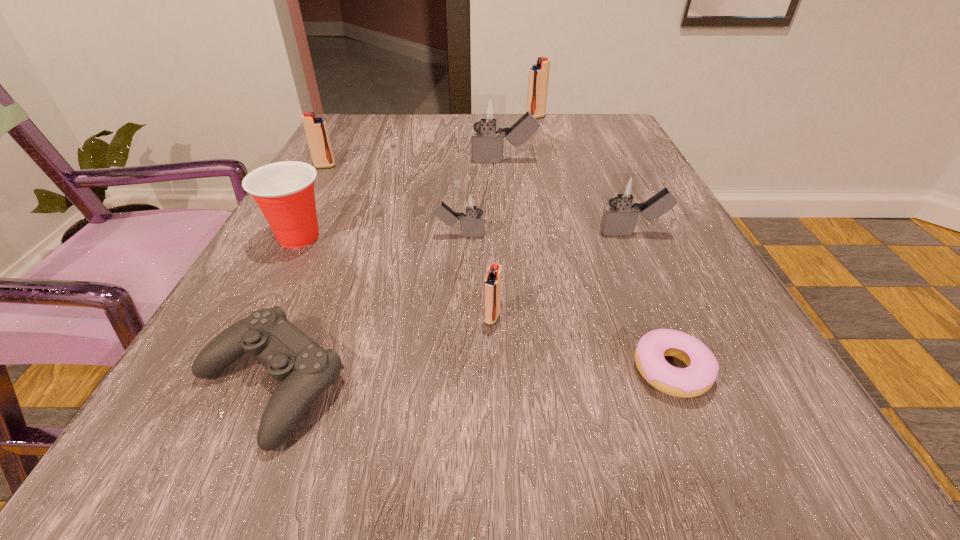
Where is `the farthest igniter`? This screenshot has width=960, height=540. the farthest igniter is located at coordinates (538, 79).

This screenshot has height=540, width=960. Find the location of `the biggest red igniter`. the biggest red igniter is located at coordinates pos(538,79).

The height and width of the screenshot is (540, 960). Find the location of `the farthest gray igniter`. the farthest gray igniter is located at coordinates (488, 112).

The image size is (960, 540). What are the coordinates of `the rightmost igniter` in the screenshot? It's located at (619, 218).

The height and width of the screenshot is (540, 960). Identify the location of the rightmost gray igniter. pos(619,218).

The height and width of the screenshot is (540, 960). Find the location of `the leftmost red igniter`. the leftmost red igniter is located at coordinates (316, 131).

Image resolution: width=960 pixels, height=540 pixels. In order to click on the leftmost igniter in this screenshot , I will do `click(316, 131)`.

Image resolution: width=960 pixels, height=540 pixels. Find the location of `red cup`. red cup is located at coordinates (284, 191).

Identify the location of the smallest red igniter. The width and height of the screenshot is (960, 540). (492, 284).

Locate an element on the screen. This screenshot has width=960, height=540. the nearest red igniter is located at coordinates tap(492, 284).